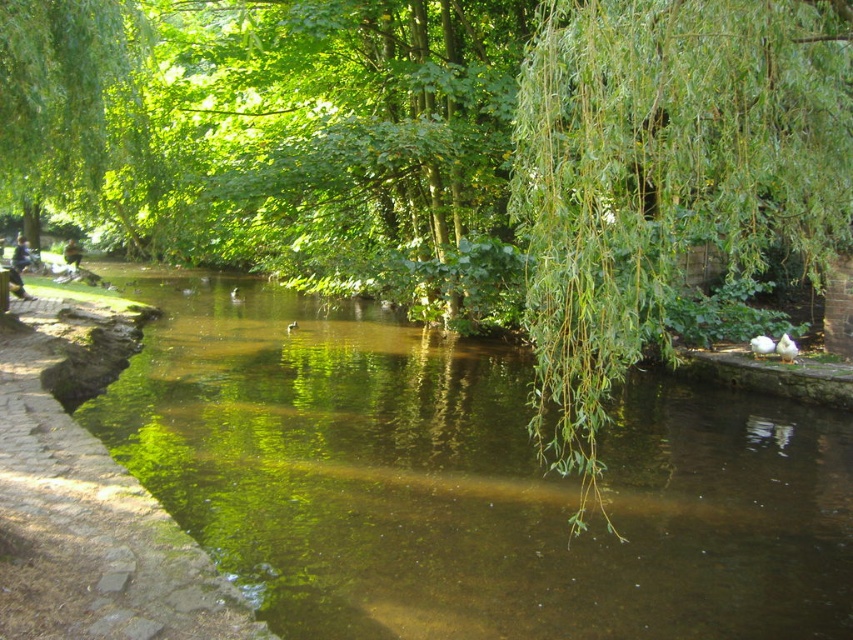
Does green reflective water at center have a larger size compared to brown stone path at left?

Yes.

In the scene shown: Does green reflective water at center appear over brown stone path at left?

No, green reflective water at center is not above brown stone path at left.

Is point (451, 595) in front of point (3, 611)?

No, (451, 595) is behind (3, 611).

Find the location of a particular element. green reflective water at center is located at coordinates (466, 481).

Is green leafy willow at right bigger than brown stone path at left?

Yes.

Is point (845, 216) closer to viewer compared to point (100, 630)?

No, it is behind (100, 630).

Image resolution: width=853 pixels, height=640 pixels. Describe the element at coordinates (664, 177) in the screenshot. I see `green leafy willow at right` at that location.

You are a GUI agent. You are given a task and a screenshot of the screen. Output one action in this format:
    pyautogui.click(x=<x>, y=<y>)
    Task: Click on the green leafy willow at right
    This screenshot has width=853, height=640.
    Given the screenshot: What is the action you would take?
    pyautogui.click(x=664, y=177)

Does green reflective water at center have a greater width compared to green leafy willow at right?

Correct, the width of green reflective water at center exceeds that of green leafy willow at right.

Consider the image. Can you confirm if green reflective water at center is positioned above green leafy willow at right?

No, green reflective water at center is not above green leafy willow at right.

Which is in front, point (786, 452) or point (734, 68)?

Positioned in front is point (734, 68).

Locate an element on the screen. The image size is (853, 640). green reflective water at center is located at coordinates (466, 481).